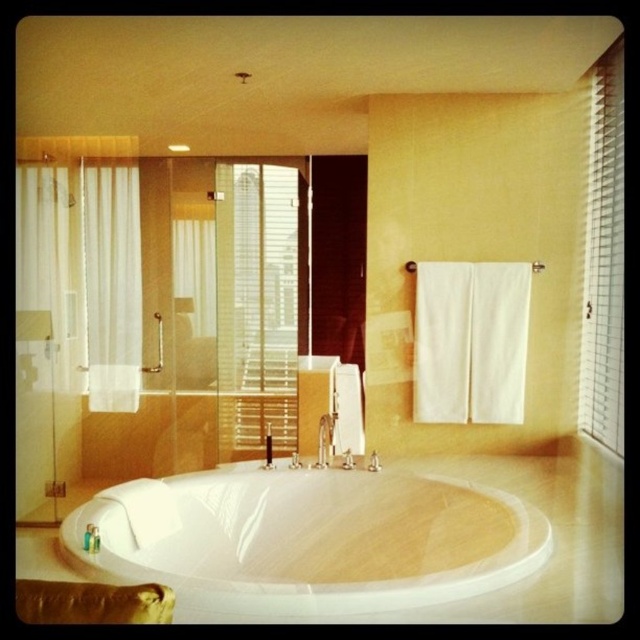
Question: Which of the following is the farthest from the observer?

Choices:
 (A) (276, 420)
 (B) (588, 401)
 (C) (330, 500)

Answer: (A)

Question: Which point is farther from the camera taking this photo?

Choices:
 (A) tap(205, 525)
 (B) tap(280, 333)
 (C) tap(586, 349)
 (D) tap(97, 337)

Answer: (B)

Question: Does white glossy bathtub at center have a greater width compared to white sheer curtain at left?

Choices:
 (A) no
 (B) yes

Answer: (B)

Question: Which point appears closest to the camera in this image?

Choices:
 (A) (595, 381)
 (B) (179, 499)
 (C) (129, 368)

Answer: (B)

Question: Is white textured blinds at upper right to the left of white sheer curtain at left from the viewer's perspective?

Choices:
 (A) no
 (B) yes

Answer: (A)

Question: Can you confirm if white textured blinds at center is bigger than white sheer curtain at left?

Choices:
 (A) yes
 (B) no

Answer: (A)